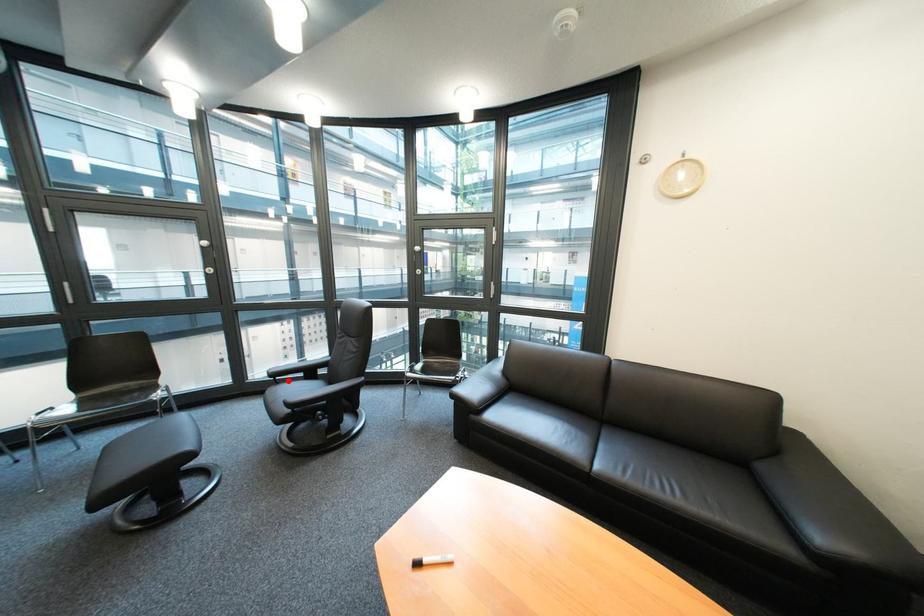
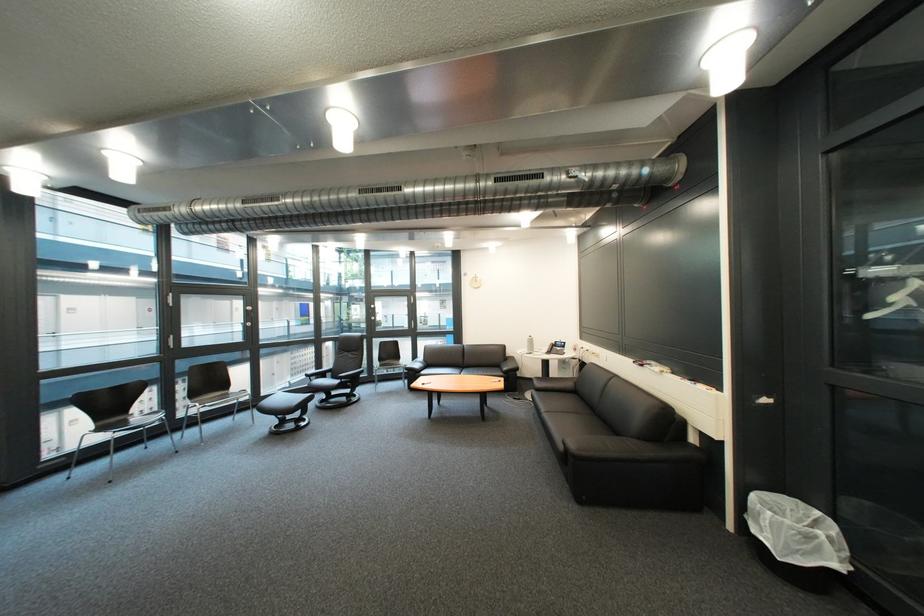
Find the pixel in the second image that matches the highlighted location in the first image.

(322, 379)